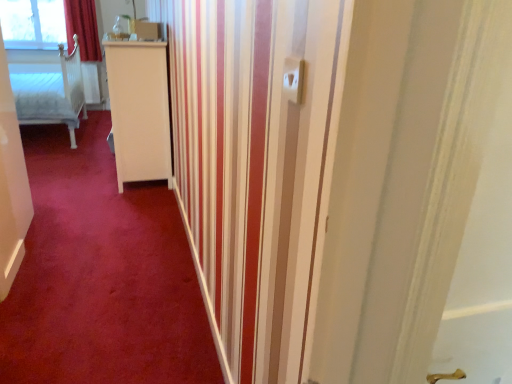
Question: From a real-world perspective, is white plastic electric outlet at upper center beneath white wooden bed at left?

Choices:
 (A) yes
 (B) no

Answer: (B)

Question: Can you confirm if white plastic electric outlet at upper center is positioned to the right of white wooden bed at left?

Choices:
 (A) yes
 (B) no

Answer: (A)

Question: Can you confirm if white plastic electric outlet at upper center is thinner than white wooden bed at left?

Choices:
 (A) no
 (B) yes

Answer: (B)

Question: Is white plastic electric outlet at upper center placed right next to white wooden bed at left?

Choices:
 (A) no
 (B) yes

Answer: (A)

Question: Is white wooden bed at left a part of white plastic electric outlet at upper center?

Choices:
 (A) yes
 (B) no

Answer: (B)

Question: Based on their sizes in the image, would you say red velvet curtain at upper left is bigger or smaller than red carpet at center?

Choices:
 (A) small
 (B) big

Answer: (A)

Question: Is point (65, 21) positioned closer to the camera than point (201, 299)?

Choices:
 (A) farther
 (B) closer

Answer: (A)

Question: Based on their positions, is red velvet curtain at upper left located to the left or right of red carpet at center?

Choices:
 (A) left
 (B) right

Answer: (A)

Question: Considering the positions of red velvet curtain at upper left and red carpet at center in the image, is red velvet curtain at upper left taller or shorter than red carpet at center?

Choices:
 (A) tall
 (B) short

Answer: (A)

Question: Visually, is transparent glass window at upper left positioned to the left or to the right of red velvet curtain at upper left?

Choices:
 (A) left
 (B) right

Answer: (A)

Question: From a real-world perspective, relative to red velvet curtain at upper left, is transparent glass window at upper left vertically above or below?

Choices:
 (A) above
 (B) below

Answer: (A)

Question: From the image's perspective, is transparent glass window at upper left above or below red velvet curtain at upper left?

Choices:
 (A) above
 (B) below

Answer: (A)

Question: Looking at their shapes, would you say transparent glass window at upper left is wider or thinner than red velvet curtain at upper left?

Choices:
 (A) wide
 (B) thin

Answer: (B)

Question: Considering the positions of red carpet at center and red velvet curtain at upper left in the image, is red carpet at center bigger or smaller than red velvet curtain at upper left?

Choices:
 (A) big
 (B) small

Answer: (A)

Question: From their relative heights in the image, would you say red carpet at center is taller or shorter than red velvet curtain at upper left?

Choices:
 (A) short
 (B) tall

Answer: (A)